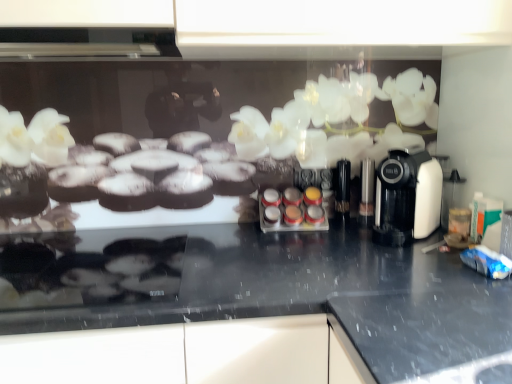
Locate an element on the screen. translucent plastic spice rack at center is located at coordinates (290, 212).

Describe the element at coordinates (407, 197) in the screenshot. This screenshot has height=384, width=512. I see `white plastic coffee machine at right` at that location.

Locate an element on the screen. The image size is (512, 384). translucent plastic spice rack at center is located at coordinates (290, 212).

Between point (271, 272) and point (298, 211), which one is positioned behind?

The point (298, 211) is behind.

Is black granite countertop at center closer to camera compared to translucent plastic spice rack at center?

That is True.

Is black granite countertop at center far from translucent plastic spice rack at center?

No, black granite countertop at center is in close proximity to translucent plastic spice rack at center.

Is black granite countertop at center turned away from translucent plastic spice rack at center?

No, black granite countertop at center is not facing away from translucent plastic spice rack at center.

Is translucent plastic spice rack at center turned away from white plastic coffee machine at right?

translucent plastic spice rack at center is not turned away from white plastic coffee machine at right.

Considering the sizes of objects translucent plastic spice rack at center and white plastic coffee machine at right in the image provided, who is wider, translucent plastic spice rack at center or white plastic coffee machine at right?

white plastic coffee machine at right.

From a real-world perspective, is translucent plastic spice rack at center physically located above or below white plastic coffee machine at right?

From a real-world perspective, translucent plastic spice rack at center is physically below white plastic coffee machine at right.

From a real-world perspective, who is located higher, white plastic coffee machine at right or black granite countertop at center?

white plastic coffee machine at right.

Can you confirm if white plastic coffee machine at right is wider than black granite countertop at center?

No.

Does white plastic coffee machine at right turn towards black granite countertop at center?

No, white plastic coffee machine at right is not turned towards black granite countertop at center.

Between point (390, 182) and point (430, 362), which one is positioned in front?

The point (430, 362) is closer to the camera.

Which of these two, white plastic coffee machine at right or translucent plastic spice rack at center, stands shorter?

translucent plastic spice rack at center is shorter.

In order to click on food below the white plastic coffee machine at right (from a real-world perspective) in this screenshot , I will do `click(290, 212)`.

Is white plastic coffee machine at right facing towards translucent plastic spice rack at center?

No, white plastic coffee machine at right does not turn towards translucent plastic spice rack at center.

Which is more to the right, white plastic coffee machine at right or translucent plastic spice rack at center?

white plastic coffee machine at right.

Does translucent plastic spice rack at center have a lesser height compared to black granite countertop at center?

Correct, translucent plastic spice rack at center is not as tall as black granite countertop at center.

Which of these two, translucent plastic spice rack at center or black granite countertop at center, is bigger?

black granite countertop at center.

From the image's perspective, which is above, translucent plastic spice rack at center or black granite countertop at center?

From the image's view, translucent plastic spice rack at center is above.

How far apart are translucent plastic spice rack at center and black granite countertop at center?

They are 13.46 inches apart.

Which object is closer to the camera taking this photo, black granite countertop at center or white plastic coffee machine at right?

black granite countertop at center is in front.

From a real-world perspective, who is located higher, black granite countertop at center or white plastic coffee machine at right?

white plastic coffee machine at right.

From the image's perspective, who appears lower, black granite countertop at center or white plastic coffee machine at right?

black granite countertop at center.

Where is `countertop below the white plastic coffee machine at right (from the image's perspective)`? The height and width of the screenshot is (384, 512). countertop below the white plastic coffee machine at right (from the image's perspective) is located at coordinates (278, 288).

You are a GUI agent. You are given a task and a screenshot of the screen. Output one action in this format:
    pyautogui.click(x=<x>, y=<y>)
    Task: Click on the food to the right of black granite countertop at center
    The width and height of the screenshot is (512, 384).
    Given the screenshot: What is the action you would take?
    pyautogui.click(x=290, y=212)

In order to click on coffee machine above the translucent plastic spice rack at center (from the image's perspective) in this screenshot , I will do `click(407, 197)`.

Looking at the image, which one is located closer to black granite countertop at center, white plastic coffee machine at right or translucent plastic spice rack at center?

The object closer to black granite countertop at center is white plastic coffee machine at right.

In the scene shown: Based on their spatial positions, is white plastic coffee machine at right or black granite countertop at center further from translucent plastic spice rack at center?

black granite countertop at center is further to translucent plastic spice rack at center.

From the image, which object appears to be nearer to white plastic coffee machine at right, translucent plastic spice rack at center or black granite countertop at center?

translucent plastic spice rack at center is closer to white plastic coffee machine at right.

Which object lies nearer to the anchor point translucent plastic spice rack at center, black granite countertop at center or white plastic coffee machine at right?

Among the two, white plastic coffee machine at right is located nearer to translucent plastic spice rack at center.

Estimate the real-world distances between objects in this image. Which object is closer to black granite countertop at center, translucent plastic spice rack at center or white plastic coffee machine at right?

The object closer to black granite countertop at center is white plastic coffee machine at right.

Based on their spatial positions, is black granite countertop at center or translucent plastic spice rack at center closer to white plastic coffee machine at right?

The object closer to white plastic coffee machine at right is translucent plastic spice rack at center.

The height and width of the screenshot is (384, 512). What are the coordinates of `food between black granite countertop at center and white plastic coffee machine at right` in the screenshot? It's located at (290, 212).